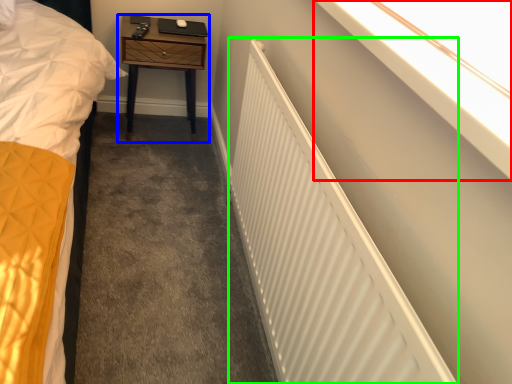
Question: Which is nearer to the window sill (highlighted by a red box)? nightstand (highlighted by a blue box) or radiator (highlighted by a green box).

Choices:
 (A) nightstand
 (B) radiator

Answer: (B)